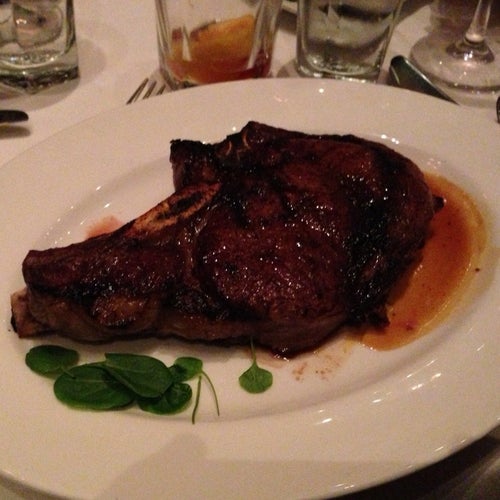
Where is `fork`? Image resolution: width=500 pixels, height=500 pixels. fork is located at coordinates (132, 97).